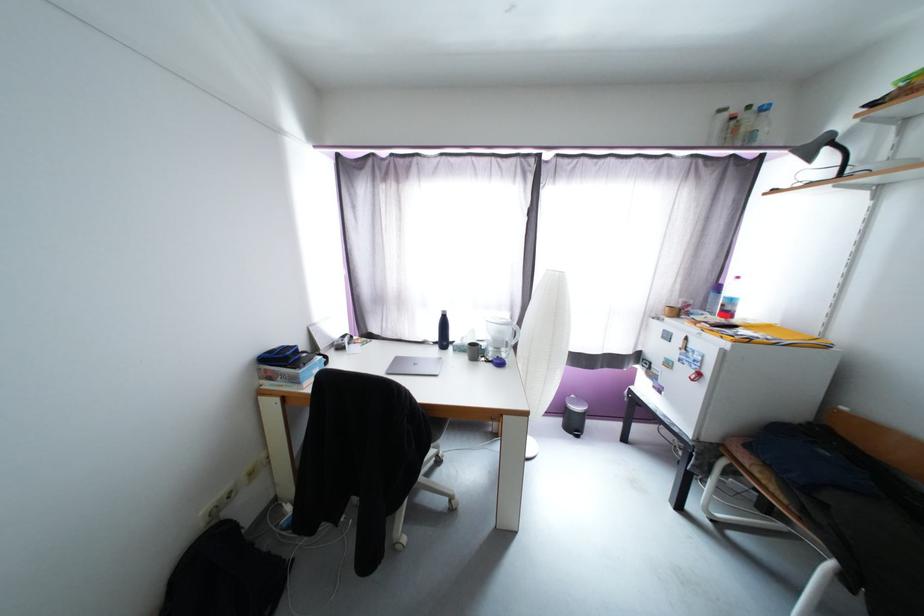
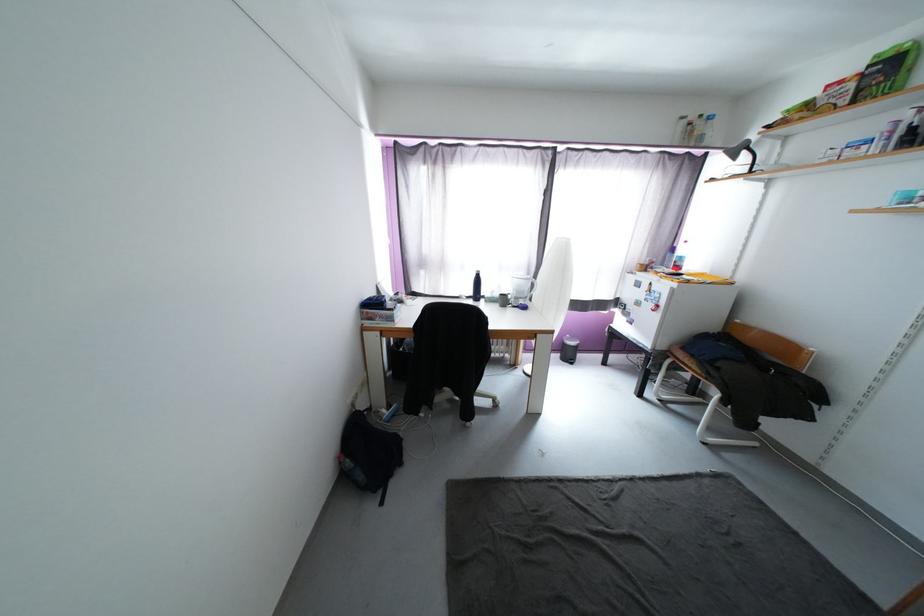
Locate, in the second image, the point that corresponds to point 565,423 in the first image.

(564, 357)